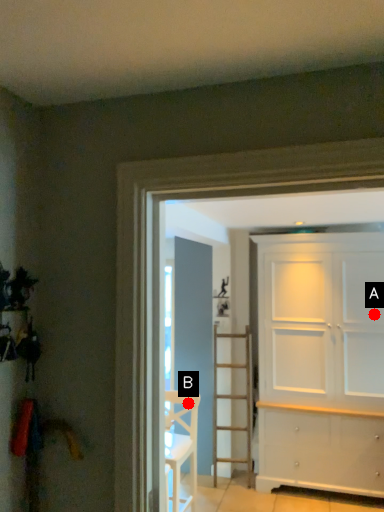
Question: Two points are circled on the image, labeled by A and B beside each circle. Which point is closer to the camera taking this photo?

Choices:
 (A) A is closer
 (B) B is closer

Answer: (B)